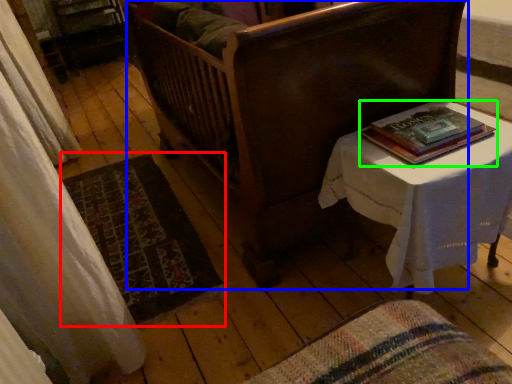
Question: Which object is positioned closest to mat (highlighted by a red box)? Select from furniture (highlighted by a blue box) and book (highlighted by a green box).

Choices:
 (A) furniture
 (B) book

Answer: (A)